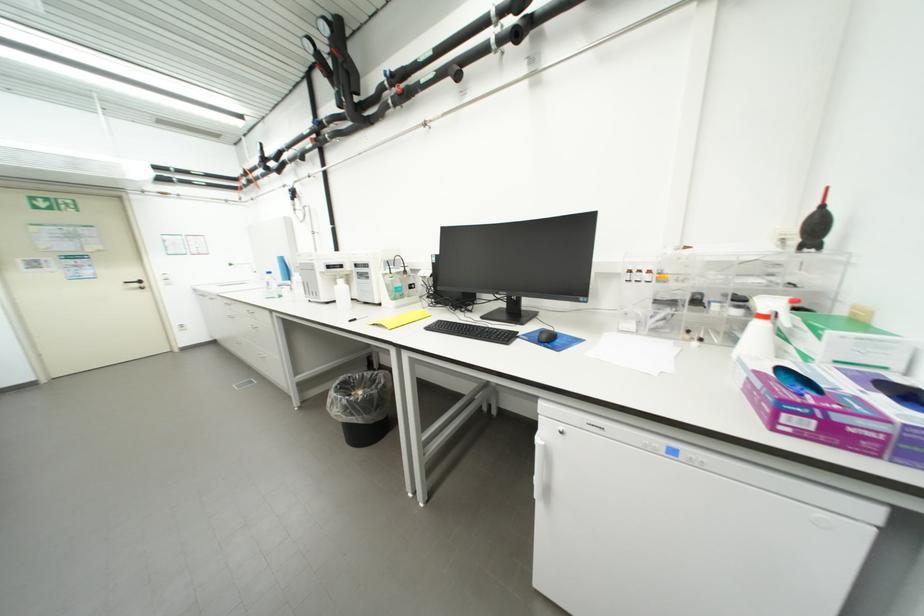
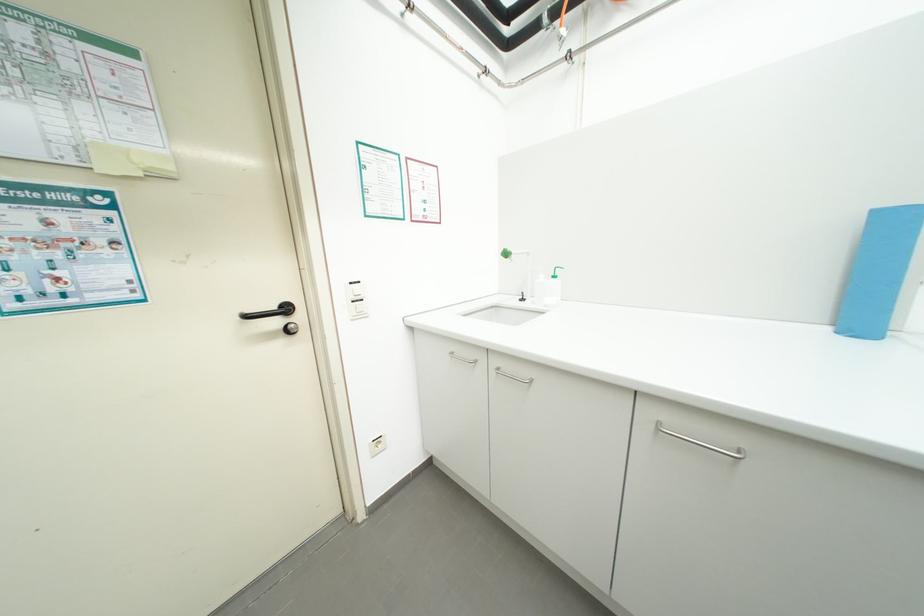
In the second image, find the point that corresponds to (144,286) in the first image.

(285, 323)